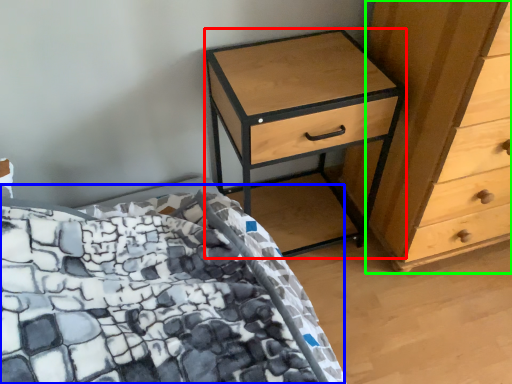
Question: Estimate the real-world distances between objects in this image. Which object is closer to nightstand (highlighted by a red box), bed (highlighted by a blue box) or chest of drawers (highlighted by a green box)?

Choices:
 (A) bed
 (B) chest of drawers

Answer: (B)